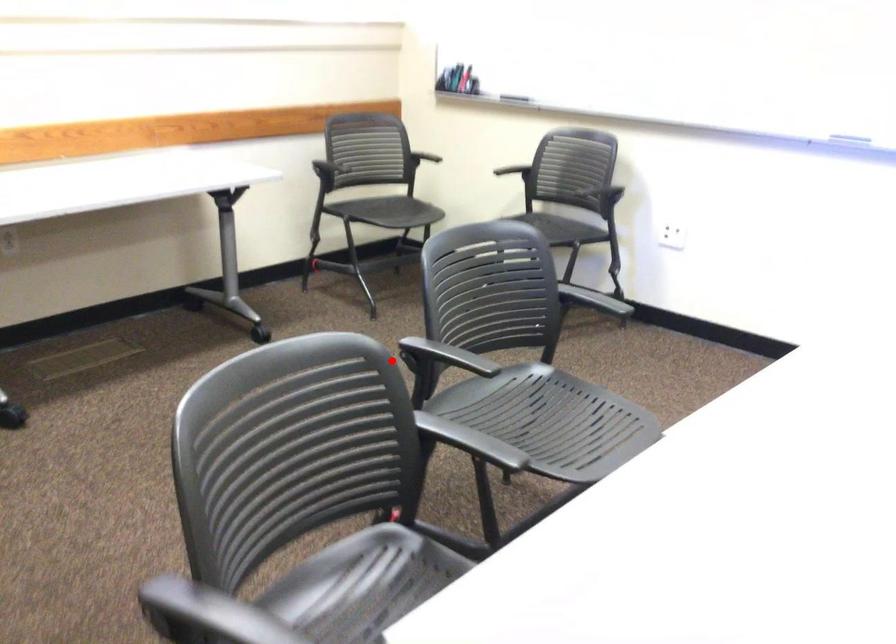
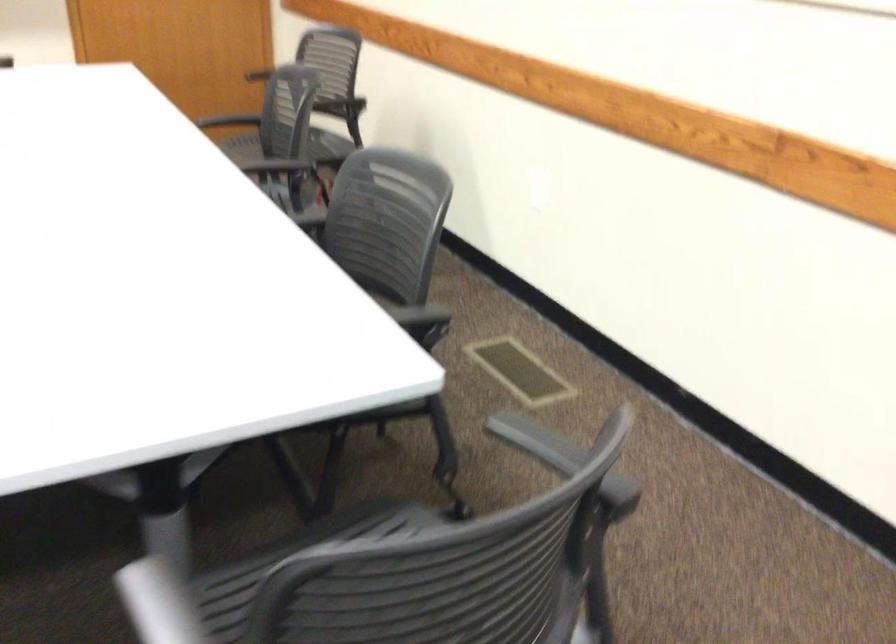
Question: A red point is marked in image1. In image2, is the corresponding 3D point closer to the camera or farther? Reply with the corresponding letter.

Choices:
 (A) The corresponding 3D point is closer.
 (B) The corresponding 3D point is farther.

Answer: (A)